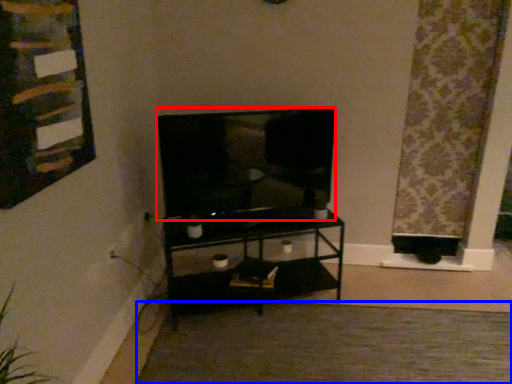
Question: Which object is closer to the camera taking this photo, television (highlighted by a red box) or plain (highlighted by a blue box)?

Choices:
 (A) television
 (B) plain

Answer: (B)